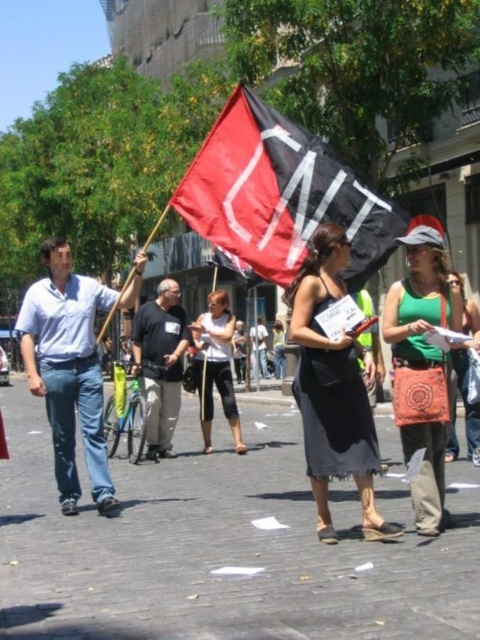
Question: Observing the image, what is the correct spatial positioning of light blue shirt at center in reference to white cotton shirt at center?

Choices:
 (A) left
 (B) right

Answer: (A)

Question: Which of the following is the farthest from the observer?

Choices:
 (A) black cotton shirt at center
 (B) green fabric purse at center
 (C) denim pants at center

Answer: (C)

Question: Does white cotton shirt at center have a larger size compared to green fabric purse at center?

Choices:
 (A) no
 (B) yes

Answer: (B)

Question: Which object is positioned farthest from the green fabric purse at right?

Choices:
 (A) black fabric flag at center
 (B) denim pants at center
 (C) black cotton shirt at center

Answer: (B)

Question: Is black fabric flag at center wider than black cotton skirt at center?

Choices:
 (A) yes
 (B) no

Answer: (B)

Question: Based on their relative distances, which object is nearer to the green fabric purse at right?

Choices:
 (A) light blue shirt at center
 (B) white cotton shirt at center
 (C) black cotton shirt at center

Answer: (A)